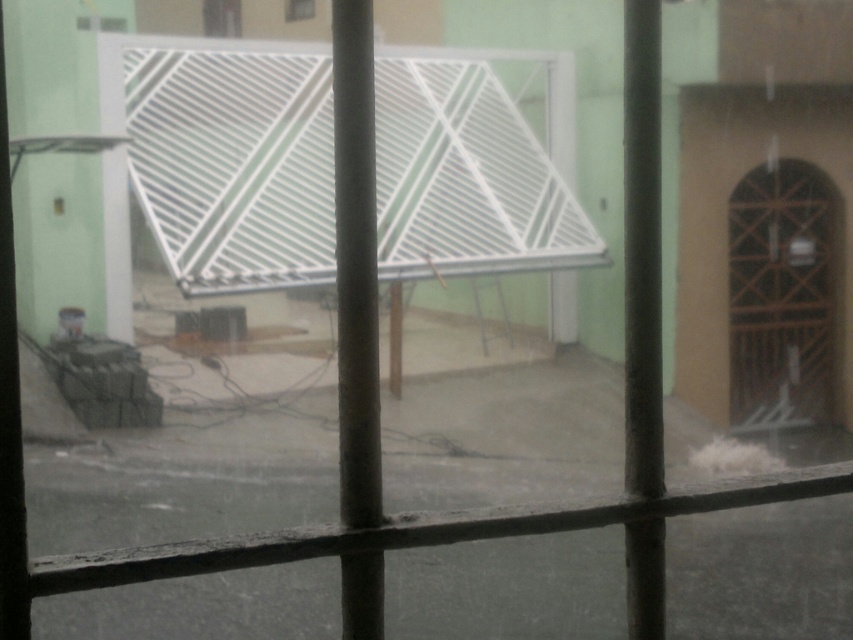
Question: Can you confirm if white matte grill at center is positioned below brown wooden door at right?

Choices:
 (A) no
 (B) yes

Answer: (A)

Question: Which point is farther to the camera?

Choices:
 (A) (492, 108)
 (B) (833, 310)

Answer: (B)

Question: Does white matte grill at center have a smaller size compared to brown wooden door at right?

Choices:
 (A) no
 (B) yes

Answer: (A)

Question: Can you confirm if white matte grill at center is thinner than brown wooden door at right?

Choices:
 (A) yes
 (B) no

Answer: (B)